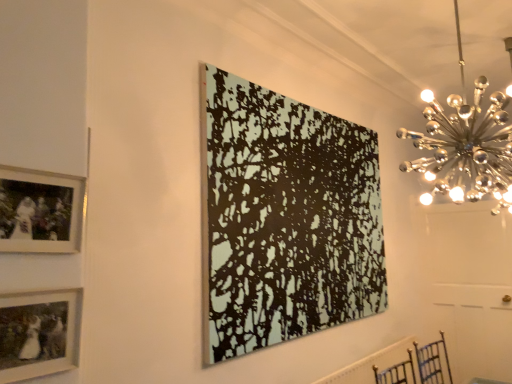
Question: Could you tell me if white textured radiator at lower right is turned towards black textured canvas at center, the 1th picture frame positioned from the back?

Choices:
 (A) yes
 (B) no

Answer: (B)

Question: Is white textured radiator at lower right positioned beyond the bounds of black textured canvas at center, the 1th picture frame positioned from the back?

Choices:
 (A) no
 (B) yes

Answer: (B)

Question: Considering the relative positions of white textured radiator at lower right and black textured canvas at center, the 3th picture frame viewed from the left, in the image provided, is white textured radiator at lower right in front of black textured canvas at center, the 3th picture frame viewed from the left,?

Choices:
 (A) yes
 (B) no

Answer: (B)

Question: Is white textured radiator at lower right thinner than black textured canvas at center, which appears as the 1th picture frame when viewed from the right?

Choices:
 (A) yes
 (B) no

Answer: (A)

Question: From the image's perspective, is white textured radiator at lower right above black textured canvas at center, the third picture frame when ordered from front to back?

Choices:
 (A) no
 (B) yes

Answer: (A)

Question: Is white textured radiator at lower right looking in the opposite direction of black textured canvas at center, the third picture frame when ordered from front to back?

Choices:
 (A) no
 (B) yes

Answer: (A)

Question: Is white textured radiator at lower right not inside matte silver picture frame at upper left, which is counted as the first picture frame, starting from the left?

Choices:
 (A) no
 (B) yes

Answer: (B)

Question: Considering the relative positions of white textured radiator at lower right and matte silver picture frame at upper left, the second picture frame viewed from the front, in the image provided, is white textured radiator at lower right behind matte silver picture frame at upper left, the second picture frame viewed from the front,?

Choices:
 (A) yes
 (B) no

Answer: (A)

Question: From a real-world perspective, is white textured radiator at lower right positioned under matte silver picture frame at upper left, the 3th picture frame viewed from the right, based on gravity?

Choices:
 (A) yes
 (B) no

Answer: (A)

Question: Can you confirm if white textured radiator at lower right is taller than matte silver picture frame at upper left, positioned as the second picture frame in back-to-front order?

Choices:
 (A) no
 (B) yes

Answer: (A)

Question: Does white textured radiator at lower right have a greater width compared to matte silver picture frame at upper left, the 3th picture frame viewed from the right?

Choices:
 (A) no
 (B) yes

Answer: (B)

Question: Could you tell me if white textured radiator at lower right is turned towards matte silver picture frame at upper left, the 3th picture frame viewed from the right?

Choices:
 (A) yes
 (B) no

Answer: (B)

Question: From the image's perspective, is matte black picture frame at lower left, arranged as the first picture frame when viewed from the front, on top of white textured radiator at lower right?

Choices:
 (A) no
 (B) yes

Answer: (B)